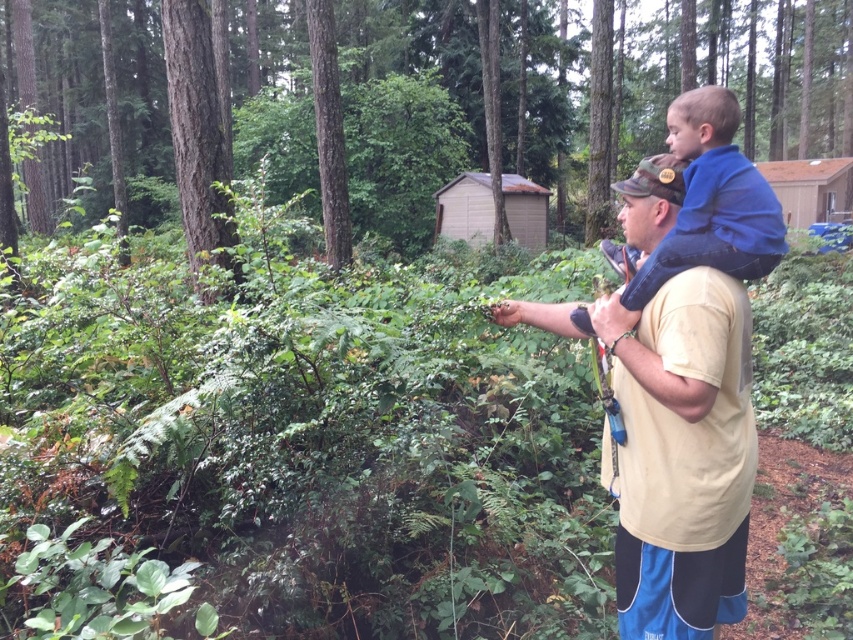
Question: Can you confirm if tan cotton shirt at center is bigger than blue fleece at upper right?

Choices:
 (A) yes
 (B) no

Answer: (A)

Question: Is tan cotton shirt at center closer to the viewer compared to blue fleece at upper right?

Choices:
 (A) yes
 (B) no

Answer: (B)

Question: Which object is farther from the camera taking this photo?

Choices:
 (A) blue fleece at upper right
 (B) tan cotton shirt at center

Answer: (B)

Question: Which object is farther from the camera taking this photo?

Choices:
 (A) tan cotton shirt at center
 (B) blue fleece at upper right

Answer: (A)

Question: Which point is farther to the camera?

Choices:
 (A) blue fleece at upper right
 (B) tan cotton shirt at center

Answer: (B)

Question: Where is tan cotton shirt at center located in relation to blue fleece at upper right in the image?

Choices:
 (A) above
 (B) below

Answer: (B)